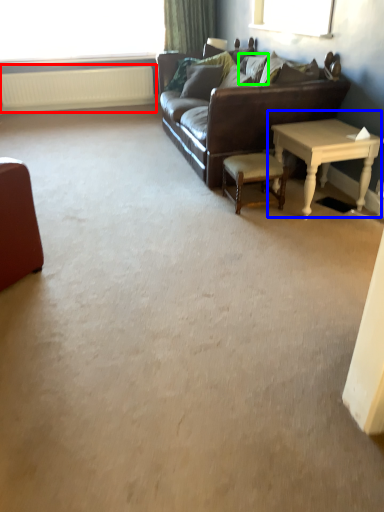
Question: Which object is the farthest from radiator (highlighted by a red box)? Choose among these: table (highlighted by a blue box) or pillow (highlighted by a green box).

Choices:
 (A) table
 (B) pillow

Answer: (A)